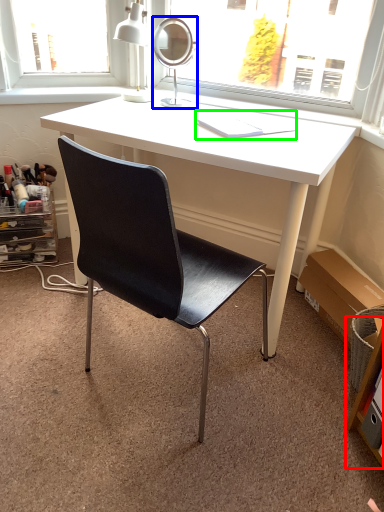
Question: Which object is the closest to the shelf (highlighted by a red box)? Choose among these: mirror (highlighted by a blue box) or book (highlighted by a green box).

Choices:
 (A) mirror
 (B) book

Answer: (B)